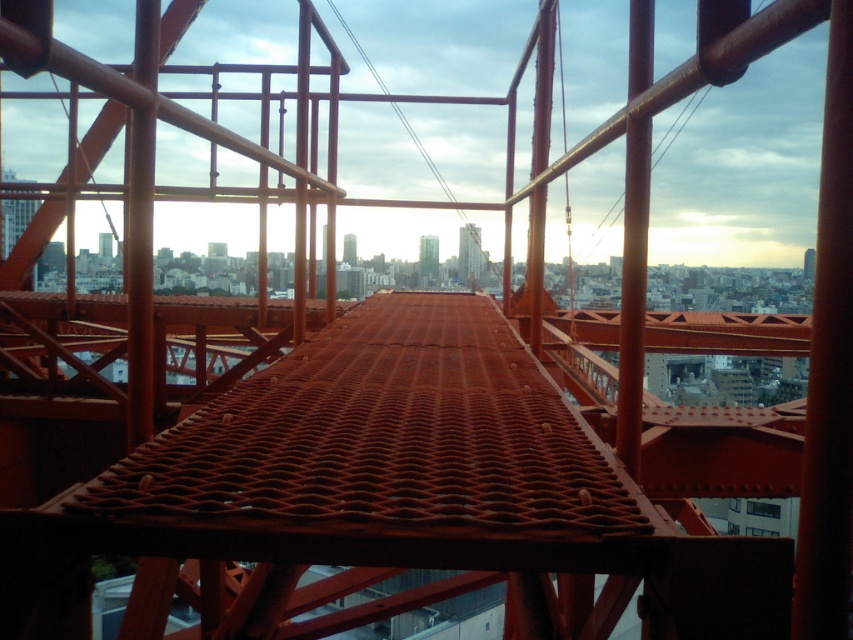
Which is more to the left, green glass tower at center or smooth orange tower at center?

Positioned to the left is smooth orange tower at center.

Is green glass tower at center positioned in front of smooth orange tower at center?

Yes, it is.

You are a GUI agent. You are given a task and a screenshot of the screen. Output one action in this format:
    pyautogui.click(x=<x>, y=<y>)
    Task: Click on the green glass tower at center
    This screenshot has height=640, width=853.
    Given the screenshot: What is the action you would take?
    pyautogui.click(x=428, y=257)

Who is more distant from viewer, (474, 273) or (434, 260)?

The point (474, 273) is behind.

Who is more forward, (474, 250) or (421, 253)?

Point (474, 250) is in front.

The width and height of the screenshot is (853, 640). Identify the location of smooth glass skyscraper at center. (469, 253).

Is smooth glass skyscraper at center wider than smooth orange tower at center?

Yes, smooth glass skyscraper at center is wider than smooth orange tower at center.

Which is more to the left, smooth glass skyscraper at center or smooth orange tower at center?

smooth orange tower at center

This screenshot has height=640, width=853. Identify the location of smooth glass skyscraper at center. (469, 253).

Image resolution: width=853 pixels, height=640 pixels. In order to click on smooth glass skyscraper at center in this screenshot , I will do `click(469, 253)`.